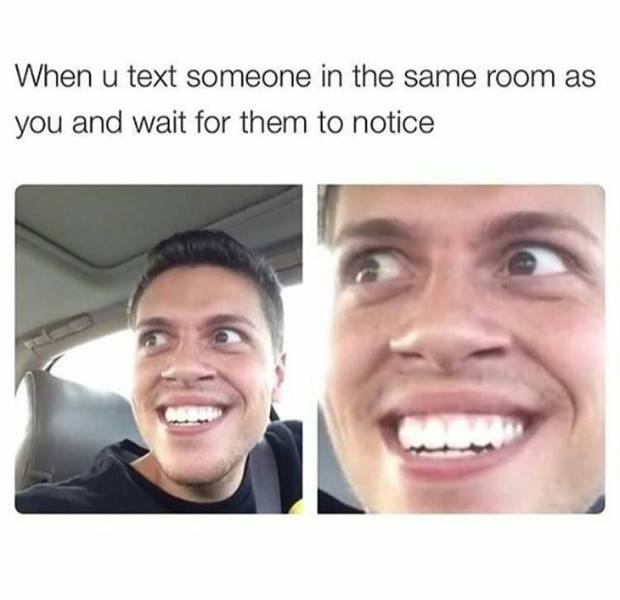
What are the coordinates of `leather head rest` in the screenshot? It's located at (90, 439).